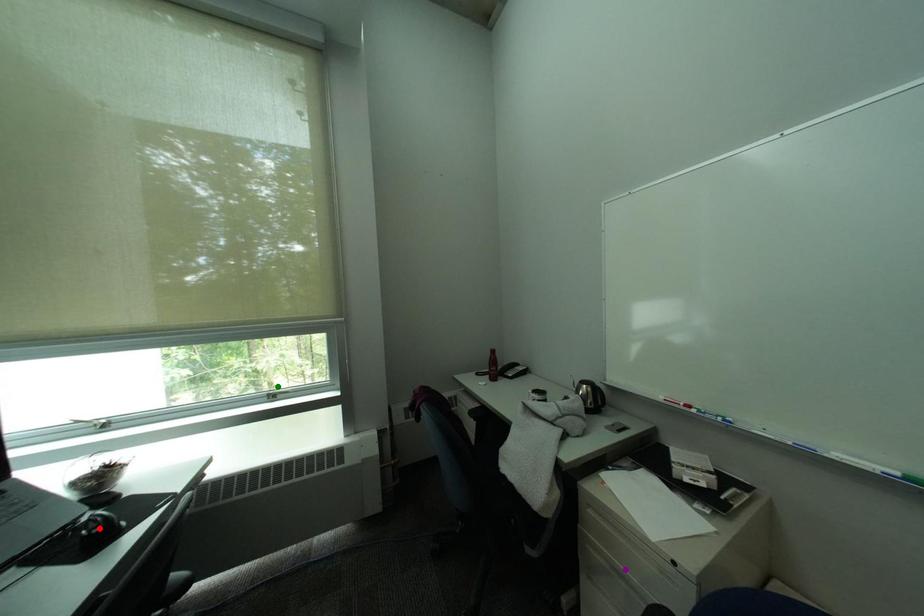
Order these from nearest to farthest:
A) red point
B) green point
C) purple point

red point → purple point → green point